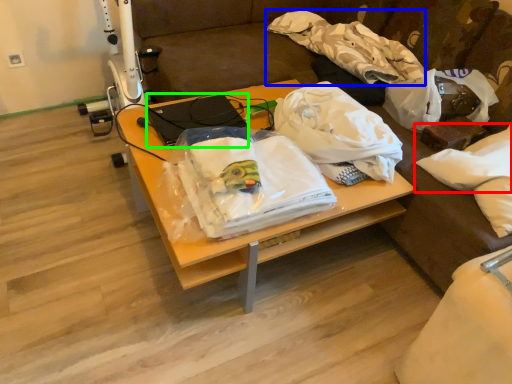
Question: Which object is the closest to the pillow (highlighted by a red box)? Choose among these: cloth (highlighted by a blue box) or laptop (highlighted by a green box).

Choices:
 (A) cloth
 (B) laptop

Answer: (A)